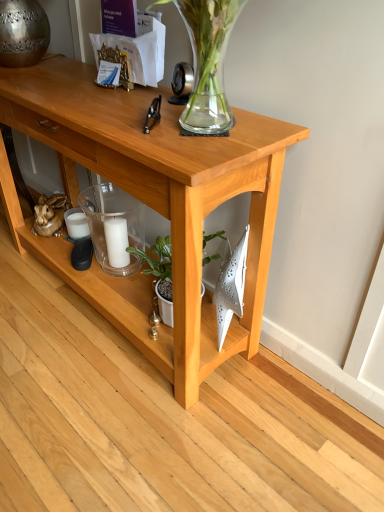
Question: Considering the relative sizes of light wood table at center and green matte plant at center in the image provided, is light wood table at center bigger than green matte plant at center?

Choices:
 (A) yes
 (B) no

Answer: (A)

Question: Is light wood table at center positioned with its back to green matte plant at center?

Choices:
 (A) no
 (B) yes

Answer: (B)

Question: Would you say light wood table at center contains green matte plant at center?

Choices:
 (A) no
 (B) yes

Answer: (B)

Question: Considering the relative sizes of light wood table at center and green matte plant at center in the image provided, is light wood table at center smaller than green matte plant at center?

Choices:
 (A) yes
 (B) no

Answer: (B)

Question: Is light wood table at center positioned beyond the bounds of green matte plant at center?

Choices:
 (A) yes
 (B) no

Answer: (A)

Question: Is light wood table at center positioned in front of green matte plant at center?

Choices:
 (A) no
 (B) yes

Answer: (B)

Question: Does white matte candle at center turn towards green matte plant at center?

Choices:
 (A) no
 (B) yes

Answer: (A)

Question: Can you confirm if white matte candle at center is taller than green matte plant at center?

Choices:
 (A) yes
 (B) no

Answer: (B)

Question: Is green matte plant at center at the back of white matte candle at center?

Choices:
 (A) yes
 (B) no

Answer: (B)

Question: From the image's perspective, is white matte candle at center beneath green matte plant at center?

Choices:
 (A) no
 (B) yes

Answer: (A)

Question: Is white matte candle at center wider than green matte plant at center?

Choices:
 (A) no
 (B) yes

Answer: (A)

Question: Considering the relative sizes of white matte candle at center and green matte plant at center in the image provided, is white matte candle at center bigger than green matte plant at center?

Choices:
 (A) no
 (B) yes

Answer: (A)

Question: Is white matte candle at center closer to the viewer compared to light wood table at center?

Choices:
 (A) no
 (B) yes

Answer: (A)